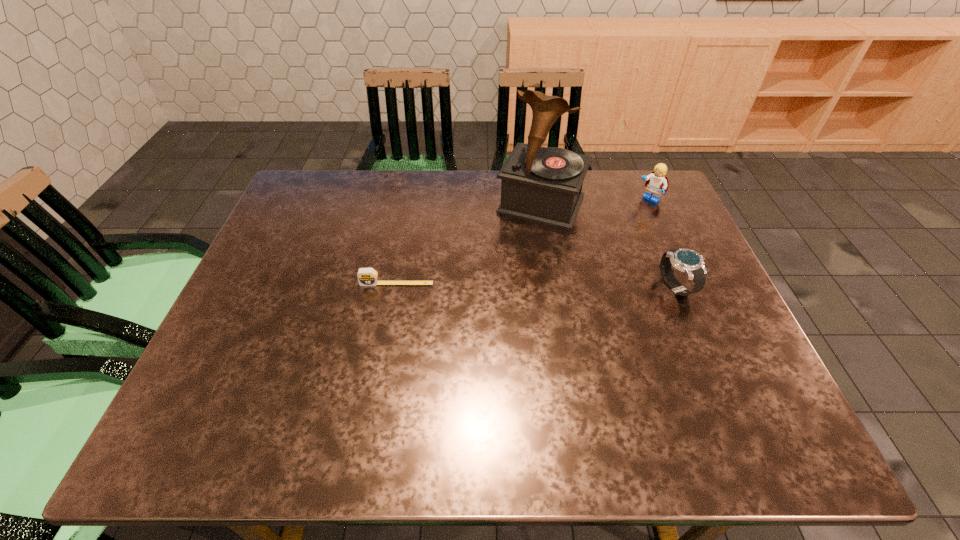
I want to click on tape measure, so click(366, 276).

Find the location of a particular element. the leftmost object is located at coordinates (366, 276).

Identify the location of the third tallest object. (688, 261).

Locate an element on the screen. phonograph_record is located at coordinates (543, 185).

I want to click on the third object from right to left, so click(543, 185).

Where is `the second tallest object`? This screenshot has height=540, width=960. the second tallest object is located at coordinates (657, 183).

Identify the location of free region located at the front of the leftmost object with the tape extended. (377, 392).

You are a GUI agent. You are given a task and a screenshot of the screen. Output one action in this format:
    pyautogui.click(x=<x>, y=<y>)
    Task: Click on the free space located 0.230m on the back of the watch
    
    Given the screenshot: What is the action you would take?
    pyautogui.click(x=646, y=214)

At what (x,y) coordinates should I click in order to perform the action: click on free space located 0.090m at the horn opening of the tallest object. Please return your answer as a coordinate pair (x, y). Looking at the image, I should click on (518, 250).

Image resolution: width=960 pixels, height=540 pixels. In order to click on vacant region located at the horn opening of the tallest object in this screenshot , I will do `click(516, 255)`.